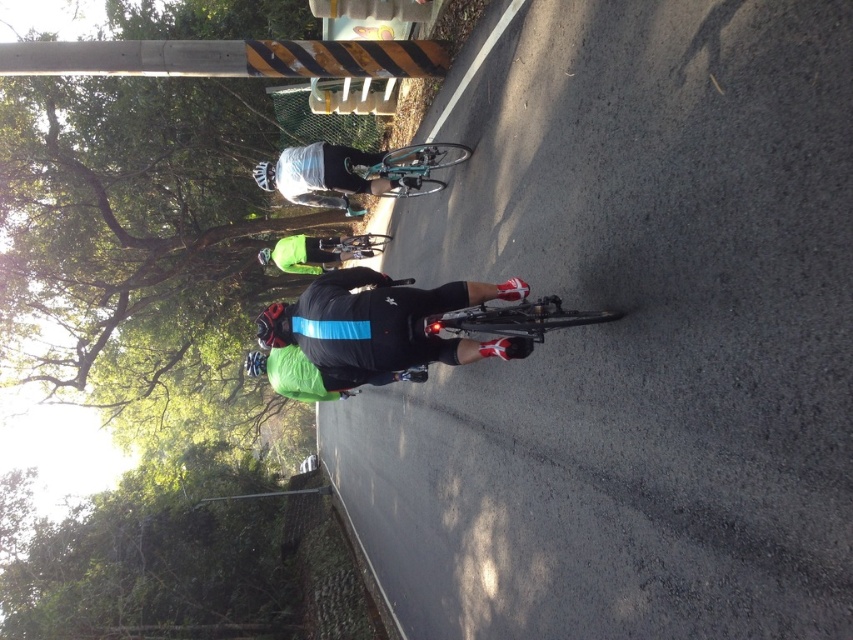
You are a cyclist planning to join the group in the image. You want to position yourself exactly at the point marked by coordinates point (380, 324). What object will you be positioned at?

The point (380, 324) corresponds to the black matte cycling suit at center, so you will be positioned at the black matte cycling suit at center.

You are a photographer trying to capture a cyclist in the scene. You notice the black matte cycling suit at center and the shiny black bicycle at center. Which object should you focus on if you want to photograph the wider one?

The black matte cycling suit at center is wider than the shiny black bicycle at center, so you should focus on the black matte cycling suit at center to capture the wider object.

You are a cyclist who wants to take a photo of the shiny black bicycle at center and the green matte jacket at center from a position where both are visible. Considering their heights, which object should you position closer to the camera to ensure both are fully visible in the frame?

The shiny black bicycle at center has a lesser height compared to green matte jacket at center. To ensure both are fully visible in the frame, position the shiny black bicycle at center closer to the camera so its smaller size in the frame balances with the taller green matte jacket at center.